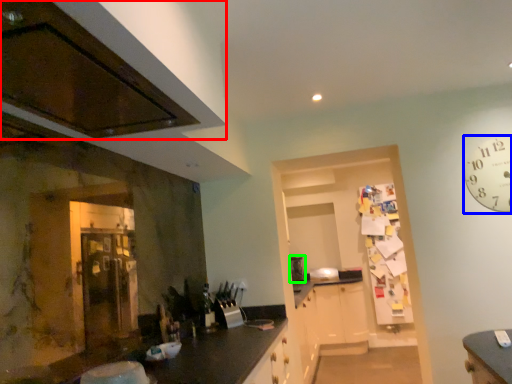
Question: Considering the real-world distances, which object is farthest from cabinetry (highlighted by a red box)? clock (highlighted by a blue box) or appliance (highlighted by a green box)?

Choices:
 (A) clock
 (B) appliance

Answer: (B)